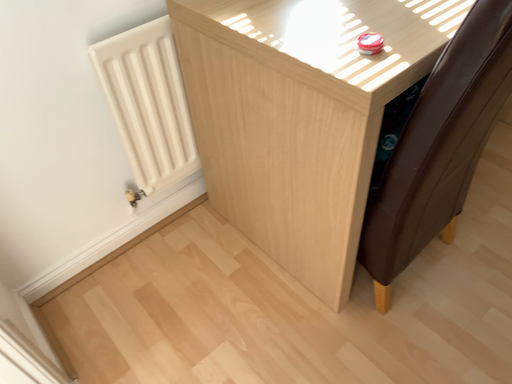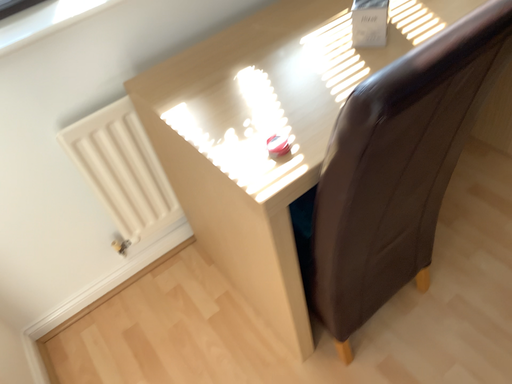
Question: Which way did the camera rotate in the video?

Choices:
 (A) rotated right
 (B) rotated left

Answer: (B)